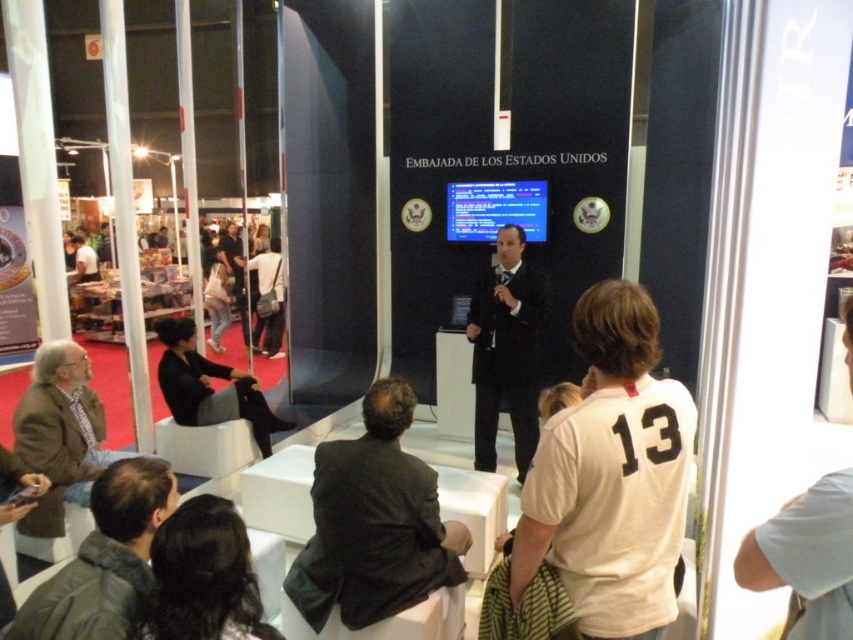
Which is in front, point (804, 502) or point (83, 241)?

Point (804, 502) is in front.

Which of these two, white cotton t-shirt at upper right or light brown leather jacket at left, stands shorter?

white cotton t-shirt at upper right

Where is `white cotton t-shirt at upper right`? The image size is (853, 640). white cotton t-shirt at upper right is located at coordinates (805, 557).

The height and width of the screenshot is (640, 853). Find the location of `white cotton t-shirt at upper right`. white cotton t-shirt at upper right is located at coordinates (805, 557).

How distant is dark gray suit at center from dark gray fabric bag at center?

dark gray suit at center and dark gray fabric bag at center are 6.13 meters apart from each other.

Is dark gray suit at center wider than dark gray fabric bag at center?

Indeed, dark gray suit at center has a greater width compared to dark gray fabric bag at center.

Where is `dark gray suit at center`? dark gray suit at center is located at coordinates (374, 522).

Can you confirm if dark gray suit at center is wider than denim pants at center?

Indeed, dark gray suit at center has a greater width compared to denim pants at center.

Does dark gray suit at center appear on the right side of denim pants at center?

Correct, you'll find dark gray suit at center to the right of denim pants at center.

Between point (376, 540) and point (223, 296), which one is positioned in front?

Point (376, 540)

You are a GUI agent. You are given a task and a screenshot of the screen. Output one action in this format:
    pyautogui.click(x=<x>, y=<y>)
    Task: Click on the dark gray suit at center
    Image resolution: width=853 pixels, height=640 pixels.
    Given the screenshot: What is the action you would take?
    pyautogui.click(x=374, y=522)